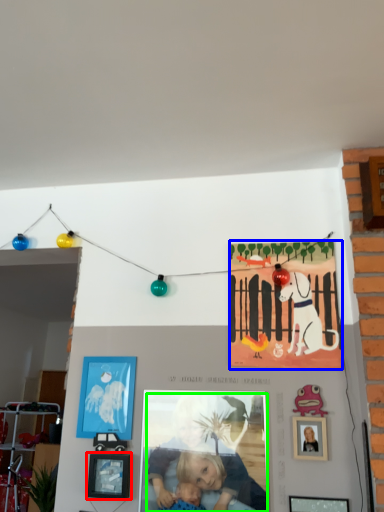
Question: Which is nearer to the picture frame (highlighted by a red box)? poster (highlighted by a blue box) or person (highlighted by a green box).

Choices:
 (A) poster
 (B) person

Answer: (B)